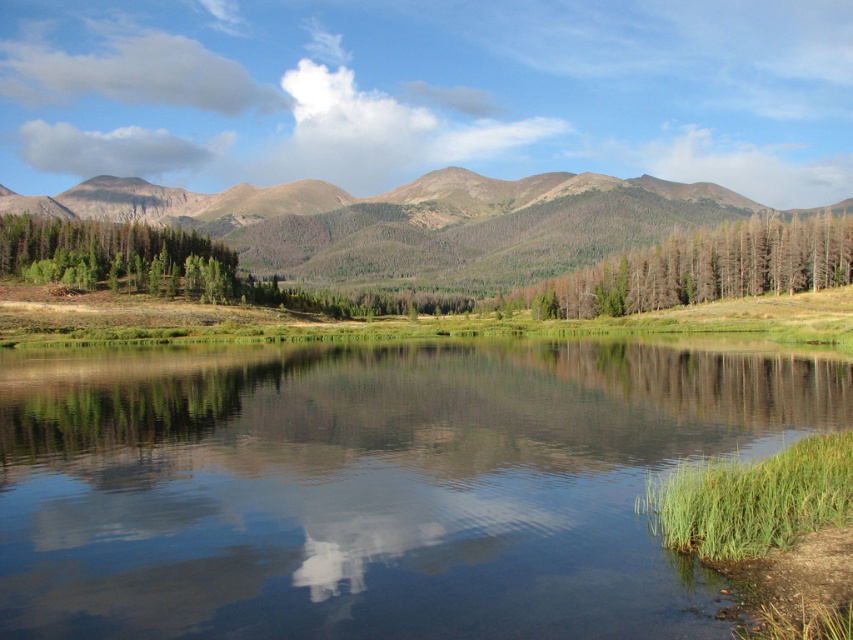
Does point (300, 352) come in front of point (730, 202)?

Yes, point (300, 352) is closer to viewer.

Is green grassy shore at lower right positioned before green forested mountain at center?

That is True.

Identify the location of green grassy shore at lower right. The height and width of the screenshot is (640, 853). (373, 484).

You are a GUI agent. You are given a task and a screenshot of the screen. Output one action in this format:
    pyautogui.click(x=<x>, y=<y>)
    Task: Click on the green grassy shore at lower right
    
    Given the screenshot: What is the action you would take?
    pyautogui.click(x=373, y=484)

Who is more forward, (526, 620) or (549, 292)?

Point (526, 620) is in front.

Does point (285, 392) lie behind point (589, 294)?

No.

At what (x,y) coordinates should I click in order to perform the action: click on green grassy shore at lower right. Please return your answer as a coordinate pair (x, y). Image resolution: width=853 pixels, height=640 pixels. Looking at the image, I should click on (373, 484).

Who is higher up, green forested mountain at center or dead wood trees at center?

green forested mountain at center is higher up.

Which is more to the left, green forested mountain at center or dead wood trees at center?

green forested mountain at center is more to the left.

At what (x,y) coordinates should I click in order to perform the action: click on green forested mountain at center. Please return your answer as a coordinate pair (x, y). Looking at the image, I should click on (419, 221).